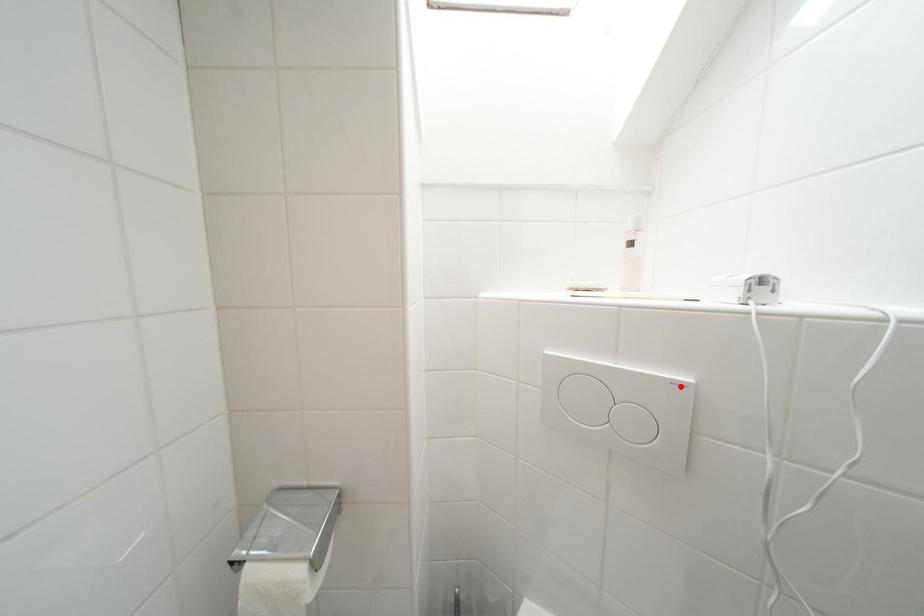
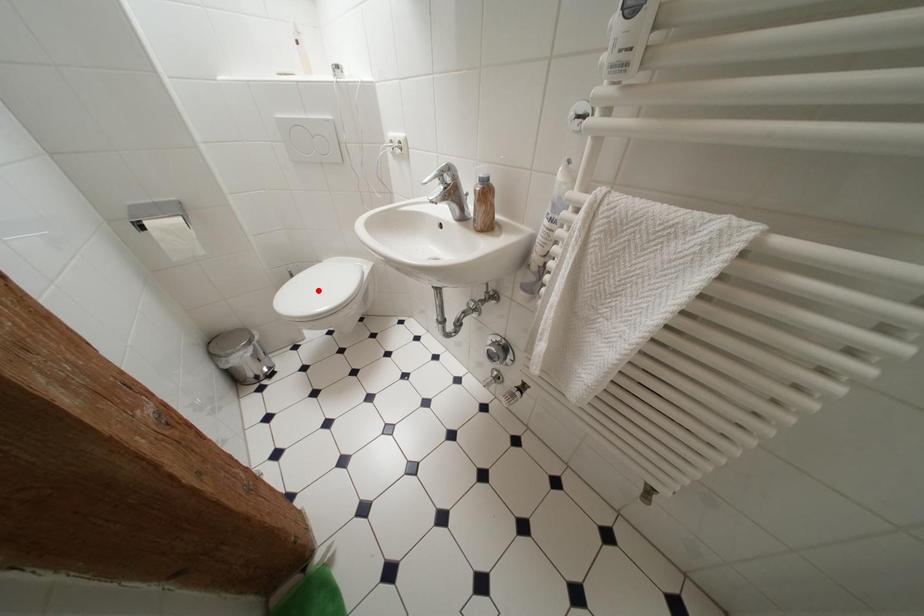
I am providing you with two images of the same scene from different viewpoints. A red point is marked on the first image and another point is marked on the second image. Does the point marked in image1 correspond to the same location as the one in image2?

No